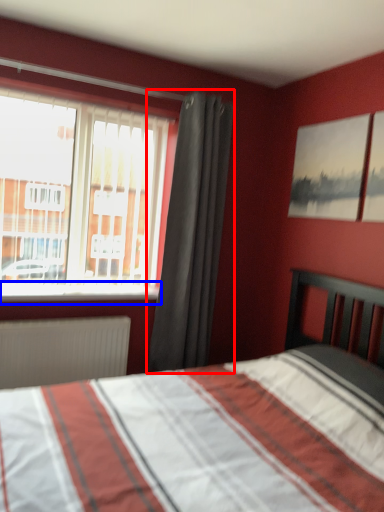
Question: Among these objects, which one is nearest to the camera, curtain (highlighted by a red box) or window sill (highlighted by a blue box)?

Choices:
 (A) curtain
 (B) window sill

Answer: (B)